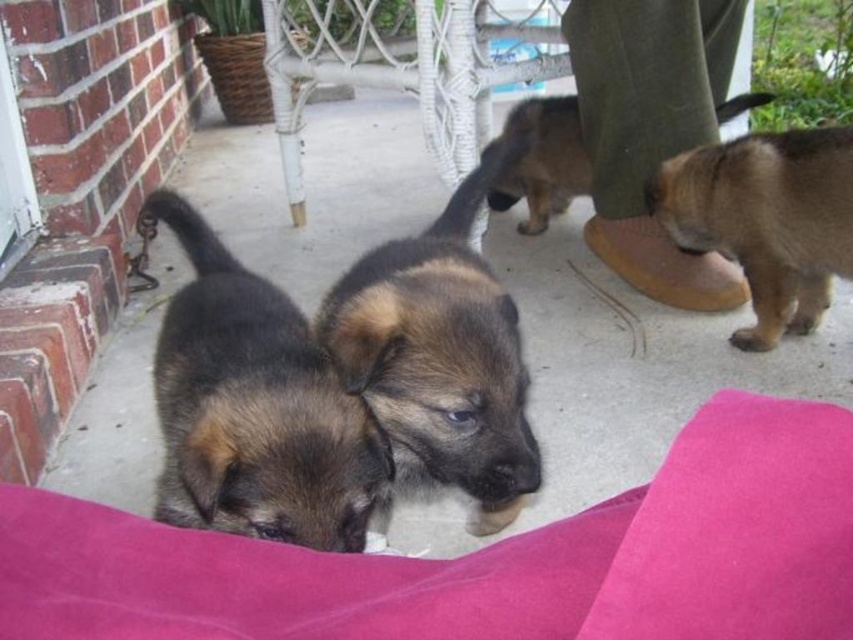
You are a photographer standing at the camera position. You want to place a small toy exactly at point (292, 435). If your toy is 5 centimeters in diameter, will it fit without overlapping any of the German Shepherd puppies?

The distance of point (292, 435) from camera is 67.06 centimeters. Since the toy is only 5 centimeters in diameter, it will fit without overlapping any puppies as long as there is enough space at that specific point on the porch.

You are a photographer trying to capture a clear shot of both the brown fuzzy dog at right and the brown fuzzy dog at center. Which dog should you focus on to ensure the one in front is sharp?

You should focus on the brown fuzzy dog at right because it is in front of the brown fuzzy dog at center, making it the closer subject for sharp focus.